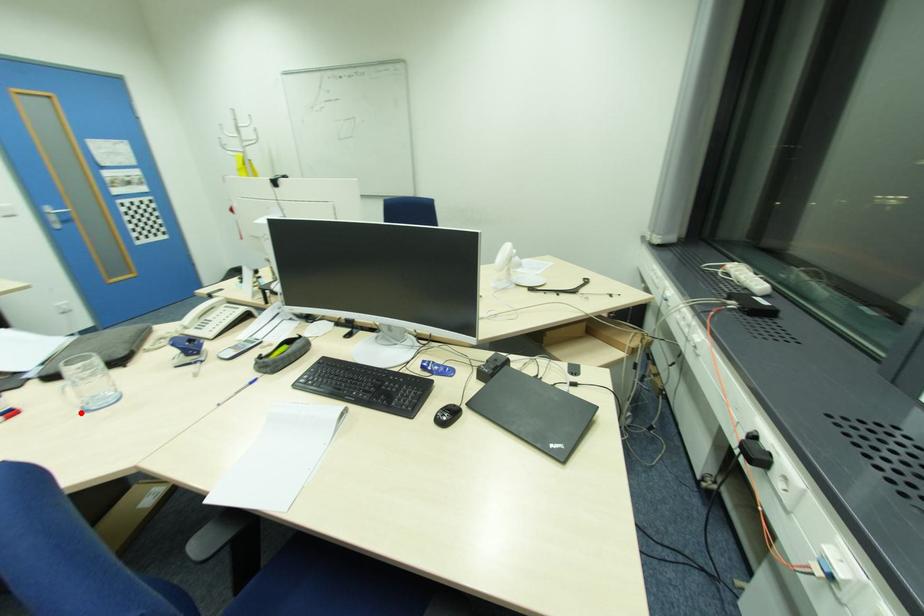
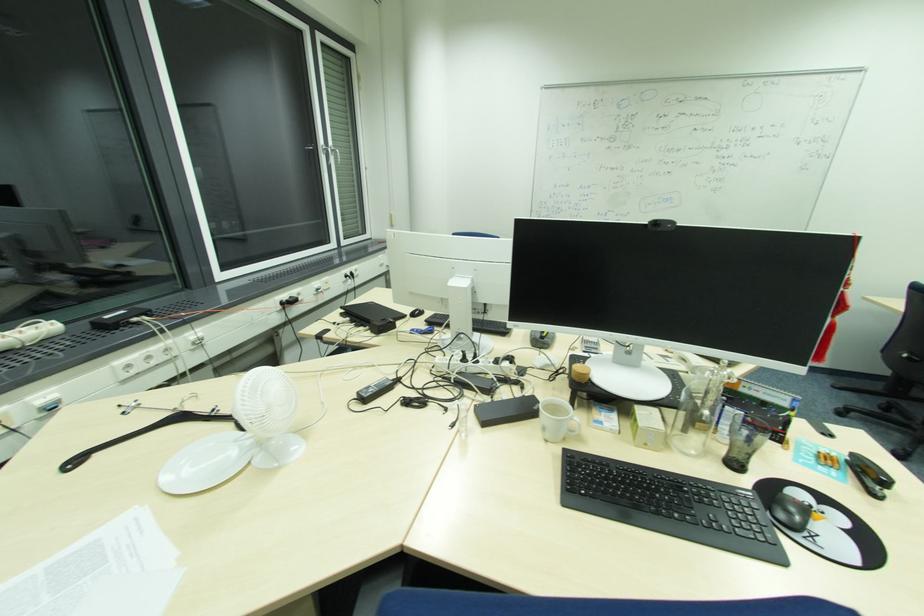
Question: I am providing you with two images of the same scene from different viewpoints. A red point is marked on the first image. Is the red point's position out of view in image 2?

Choices:
 (A) Yes
 (B) No

Answer: (A)